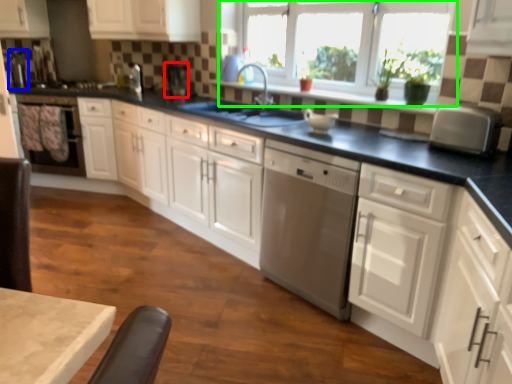
Question: Which object is the closest to the appliance (highlighted by a red box)? Choose among these: appliance (highlighted by a blue box) or window (highlighted by a green box).

Choices:
 (A) appliance
 (B) window

Answer: (B)